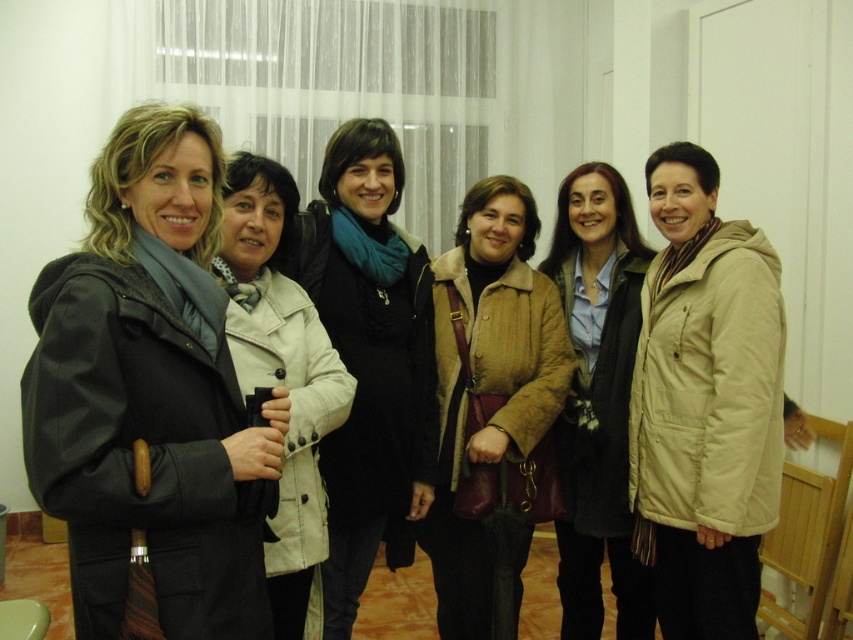
Can you confirm if beige cotton jacket at center is positioned below matte beige coat at center?

Actually, beige cotton jacket at center is above matte beige coat at center.

Between beige cotton jacket at center and matte beige coat at center, which one appears on the left side from the viewer's perspective?

From the viewer's perspective, matte beige coat at center appears more on the left side.

Find the location of a particular element. beige cotton jacket at center is located at coordinates (705, 403).

Which is in front, point (664, 636) or point (473, 492)?

Point (473, 492)

Locate an element on the screen. beige cotton jacket at center is located at coordinates point(705,403).

Find the location of `beige cotton jacket at center`. beige cotton jacket at center is located at coordinates [705, 403].

Can you confirm if tan quilted jacket at center is wider than blue scarf at center?

Yes, tan quilted jacket at center is wider than blue scarf at center.

Who is more distant from viewer, (454,413) or (288,275)?

The point (454,413) is behind.

Find the location of a particular element. Image resolution: width=853 pixels, height=640 pixels. tan quilted jacket at center is located at coordinates (492, 410).